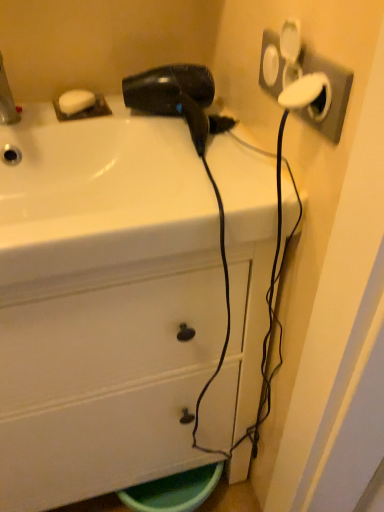
Question: Looking at their shapes, would you say white glossy cabinet at center is wider or thinner than white matte soap at upper left?

Choices:
 (A) thin
 (B) wide

Answer: (B)

Question: Visually, is white glossy cabinet at center positioned to the left or to the right of white matte soap at upper left?

Choices:
 (A) left
 (B) right

Answer: (B)

Question: Considering the real-world distances, which object is farthest from the white matte soap at upper left?

Choices:
 (A) white plastic socket at upper right
 (B) white glossy sink at upper center
 (C) white glossy cabinet at center
 (D) black matte hair dryer at upper center
 (E) brushed metal faucet at upper left

Answer: (C)

Question: Estimate the real-world distances between objects in this image. Which object is closer to the black matte hair dryer at upper center?

Choices:
 (A) brushed metal faucet at upper left
 (B) white glossy cabinet at center
 (C) white matte soap at upper left
 (D) white plastic socket at upper right
 (E) white glossy sink at upper center

Answer: (E)